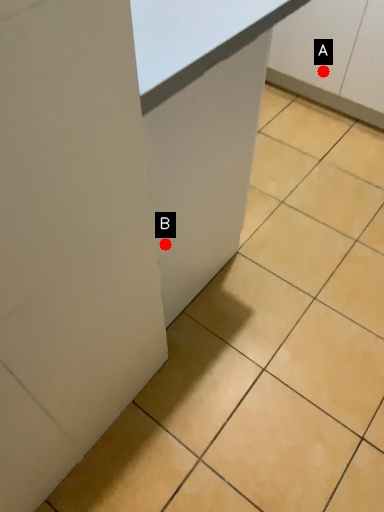
Question: Two points are circled on the image, labeled by A and B beside each circle. Which point appears closest to the camera in this image?

Choices:
 (A) A is closer
 (B) B is closer

Answer: (B)